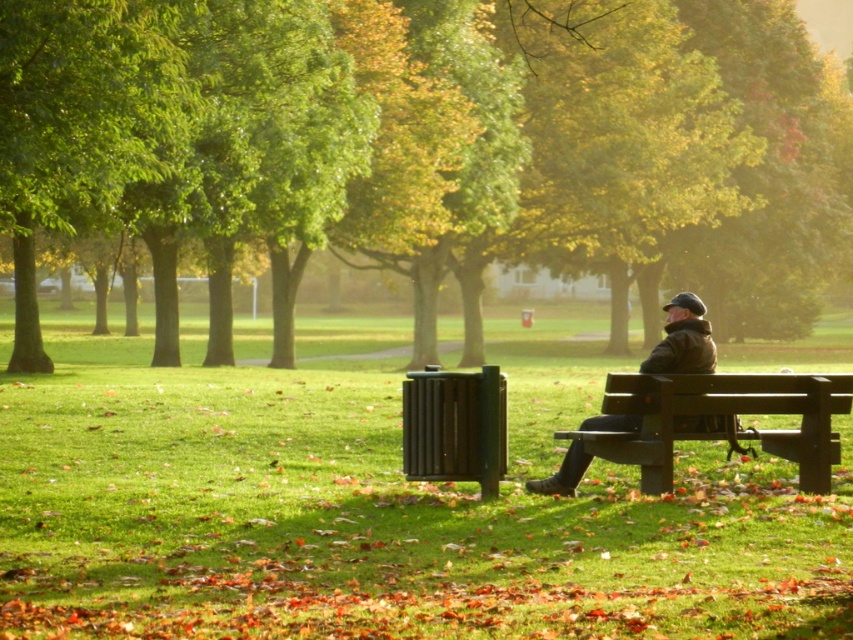
Can you confirm if wooden bench at right is wider than dark brown leather jacket at center?

Yes, wooden bench at right is wider than dark brown leather jacket at center.

Does point (828, 420) lie in front of point (572, 452)?

That is True.

This screenshot has height=640, width=853. What do you see at coordinates (718, 413) in the screenshot?
I see `wooden bench at right` at bounding box center [718, 413].

The width and height of the screenshot is (853, 640). In order to click on wooden bench at right in this screenshot , I will do `click(718, 413)`.